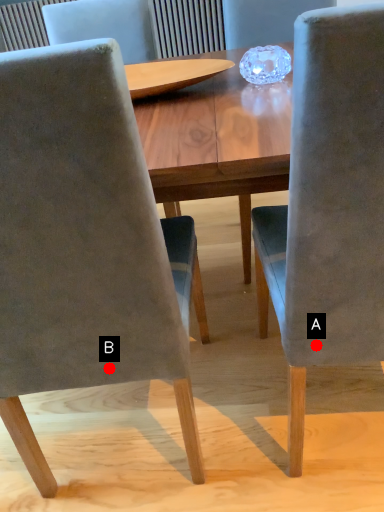
Question: Two points are circled on the image, labeled by A and B beside each circle. Which of the following is the closest to the observer?

Choices:
 (A) A is closer
 (B) B is closer

Answer: (A)